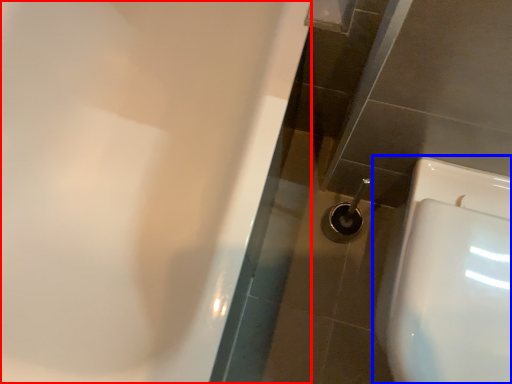
Question: Which of the following is the closest to the observer, bath (highlighted by a red box) or toilet (highlighted by a blue box)?

Choices:
 (A) bath
 (B) toilet

Answer: (A)